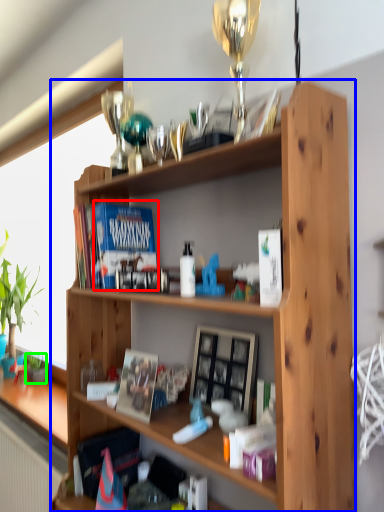
Question: Which object is the farthest from paperback book (highlighted by a red box)? Choose among these: shelf (highlighted by a blue box) or houseplant (highlighted by a green box).

Choices:
 (A) shelf
 (B) houseplant

Answer: (B)